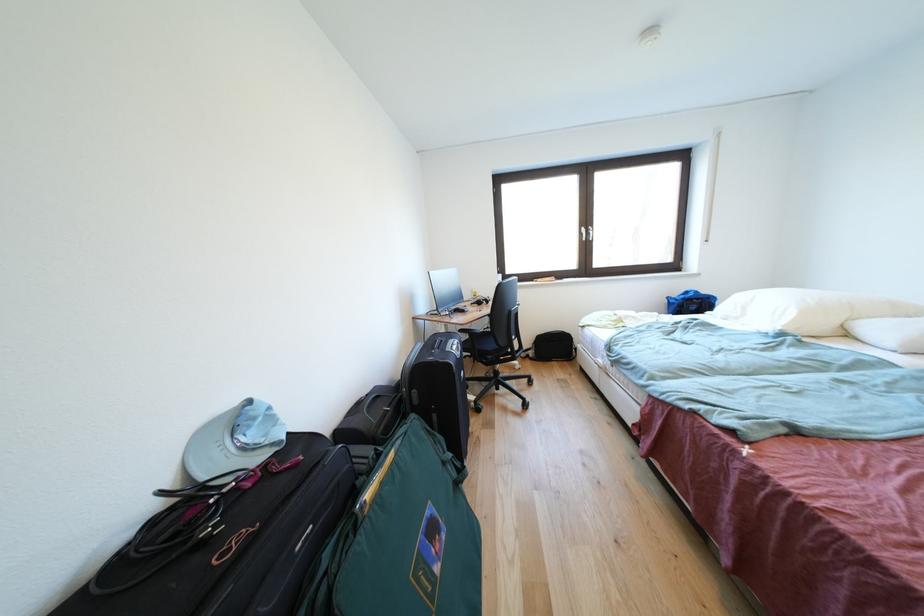
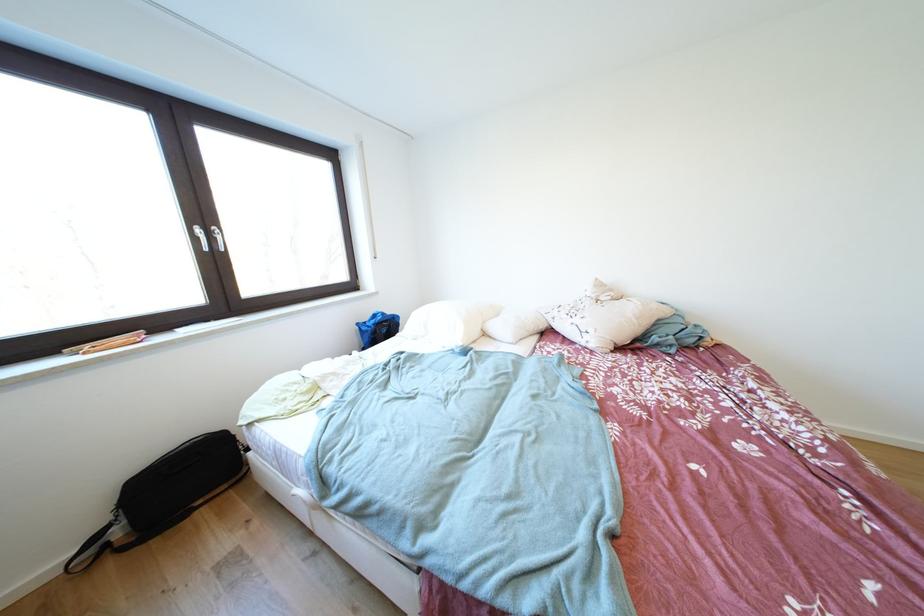
Locate, in the second image, the point that corresponds to (723,302) in the first image.

(407, 321)